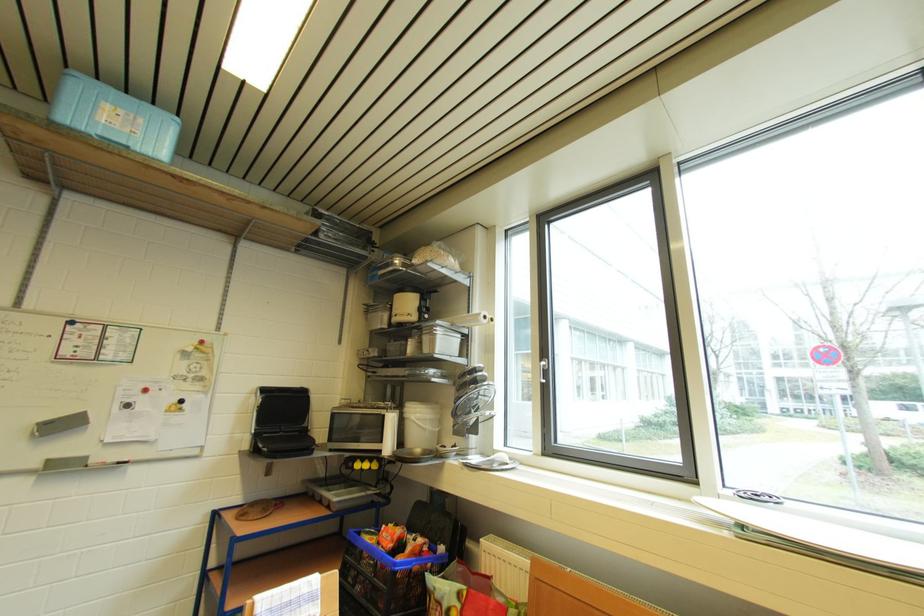
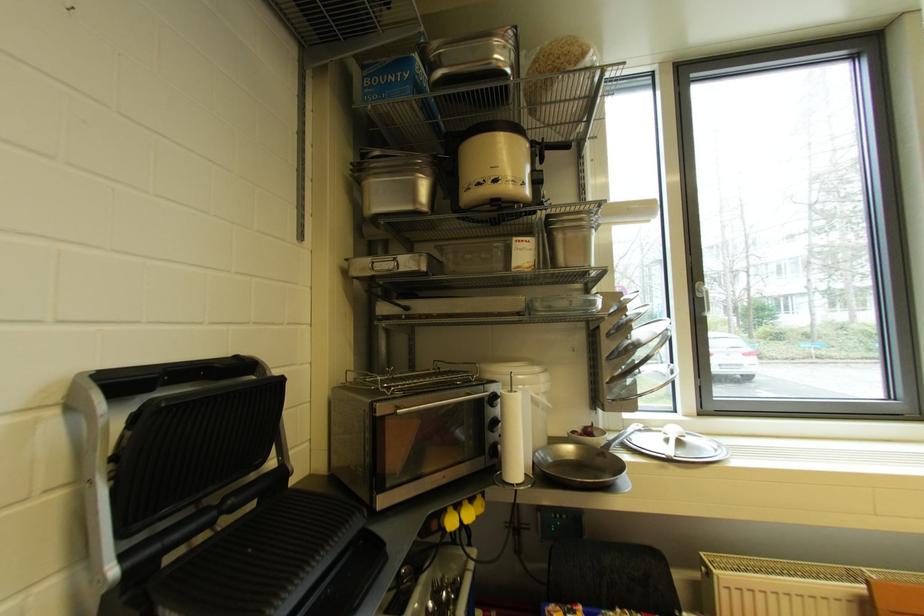
Find the pixel in the second image that matches the point at 386,282 in the first image.

(420, 97)